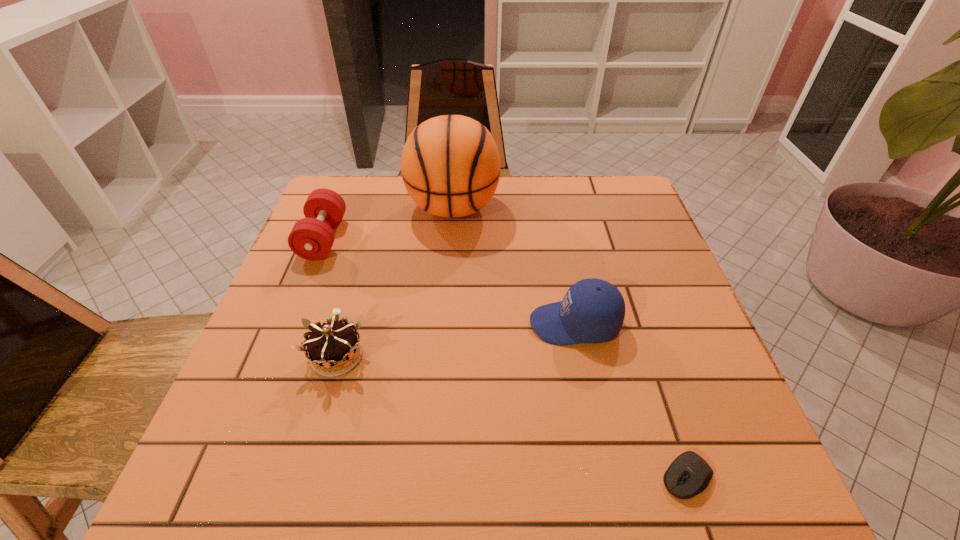
Select which object appears as the third closest to the cap. Please provide its 2D coordinates. Your answer should be formatted as a tuple, i.e. [(x, y)], where the tuple contains the x and y coordinates of a point satisfying the conditions above.

[(330, 345)]

This screenshot has width=960, height=540. What are the coordinates of `free space that satisfies the following two spatial constraints: 1. on the front-facing side of the cap; 2. on the right side of the computer equipment` in the screenshot? It's located at (605, 477).

Where is `free space in the image that satisfies the following two spatial constraints: 1. on the back side of the shortest object; 2. on the front-facing side of the cap`? Image resolution: width=960 pixels, height=540 pixels. free space in the image that satisfies the following two spatial constraints: 1. on the back side of the shortest object; 2. on the front-facing side of the cap is located at coordinates (636, 324).

This screenshot has width=960, height=540. I want to click on vacant area in the image that satisfies the following two spatial constraints: 1. on the front side of the dumbbell; 2. on the left side of the crown, so click(276, 356).